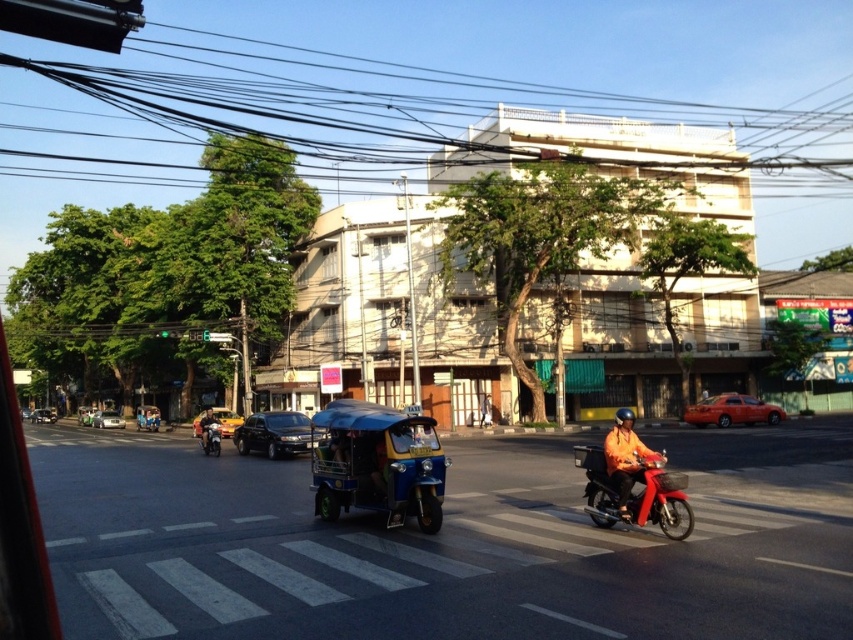
Who is positioned more to the right, shiny black sedan at center or orange matte helmet at center?

orange matte helmet at center is more to the right.

Is the position of shiny black sedan at center more distant than that of orange matte helmet at center?

Yes, it is behind orange matte helmet at center.

The width and height of the screenshot is (853, 640). In order to click on shiny black sedan at center in this screenshot , I will do `click(274, 433)`.

Based on the photo, is orange fabric motorbike at center taller than orange fabric helmet at center?

Correct, orange fabric motorbike at center is much taller as orange fabric helmet at center.

Who is more forward, [671,520] or [202,419]?

Positioned in front is point [671,520].

At what (x,y) coordinates should I click in order to perform the action: click on orange fabric motorbike at center. Please return your answer as a coordinate pair (x, y). Looking at the image, I should click on [631, 481].

Find the location of a particular element. This screenshot has height=640, width=853. orange fabric motorbike at center is located at coordinates (631, 481).

Does shiny black sedan at center have a greater width compared to matte black sedan at center?

No.

Which is behind, point (254, 420) or point (38, 420)?

The point (38, 420) is behind.

Where is `shiny black sedan at center`? The height and width of the screenshot is (640, 853). shiny black sedan at center is located at coordinates (274, 433).